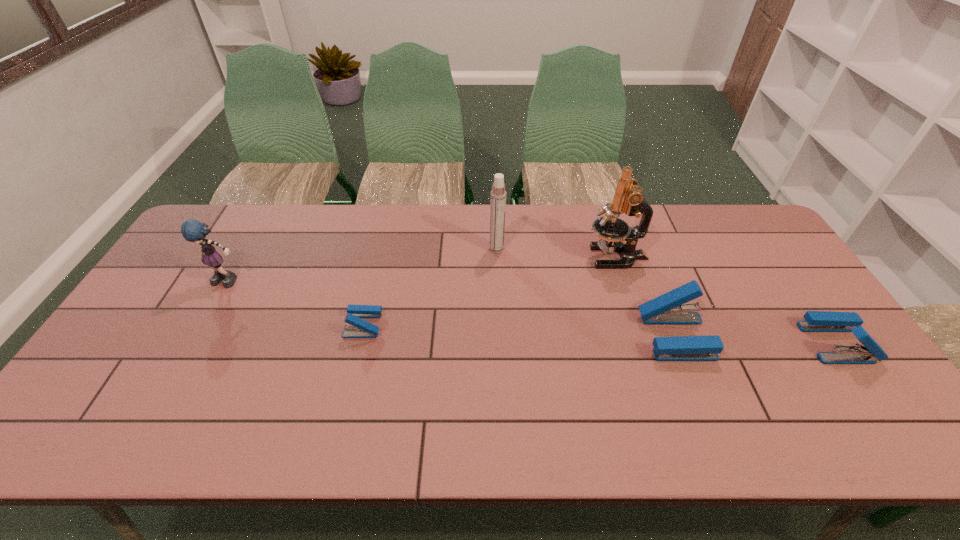
Locate an element on the screen. This screenshot has height=540, width=960. the shortest stapler is located at coordinates (360, 328).

Where is `the leftmost stapler`? This screenshot has height=540, width=960. the leftmost stapler is located at coordinates (360, 328).

In order to click on the second stapler from left to right in this screenshot , I will do `click(670, 308)`.

You are a GUI agent. You are given a task and a screenshot of the screen. Output one action in this format:
    pyautogui.click(x=<x>, y=<y>)
    Task: Click on the rightmost stapler
    
    Given the screenshot: What is the action you would take?
    pyautogui.click(x=816, y=321)

The height and width of the screenshot is (540, 960). What are the coordinates of `the second shortest stapler` in the screenshot? It's located at (816, 321).

In order to click on the fourth object from right to left in this screenshot , I will do `click(498, 194)`.

In order to click on the second tallest object in this screenshot , I will do `click(498, 194)`.

Find the location of `microscope`. microscope is located at coordinates (628, 198).

The width and height of the screenshot is (960, 540). I want to click on the leftmost object, so click(192, 230).

The width and height of the screenshot is (960, 540). What are the coordinates of `rag doll` in the screenshot? It's located at (192, 230).